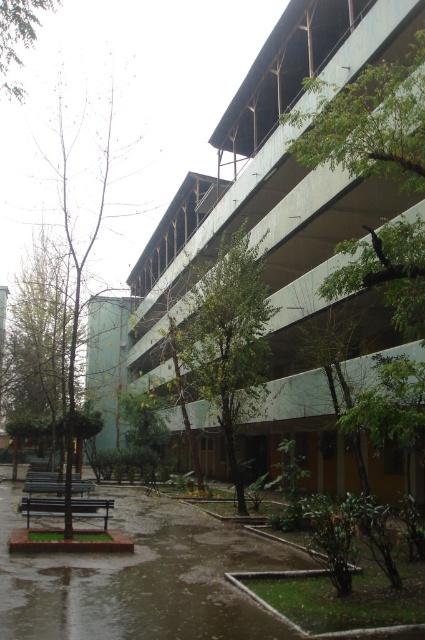
Does green leafy tree at left appear under wooden park bench at lower left?

Incorrect, green leafy tree at left is not positioned below wooden park bench at lower left.

Does green leafy tree at left have a larger size compared to wooden park bench at lower left?

Indeed, green leafy tree at left has a larger size compared to wooden park bench at lower left.

Is point (48, 310) positioned after point (59, 492)?

Yes, point (48, 310) is farther from viewer.

The width and height of the screenshot is (425, 640). I want to click on green leafy tree at left, so click(x=37, y=348).

Which is behind, point (116, 145) or point (6, 20)?

Point (116, 145)

Does bare wood tree at left have a smaller size compared to green leafy tree at upper left?

Yes.

You are a GUI agent. You are given a task and a screenshot of the screen. Output one action in this format:
    pyautogui.click(x=<x>, y=<y>)
    Task: Click on the bare wood tree at left
    This screenshot has width=425, height=640.
    Given the screenshot: What is the action you would take?
    pyautogui.click(x=82, y=202)

Can you confirm if green leafy tree at center is bigger than green leafy tree at left?

No, green leafy tree at center is not bigger than green leafy tree at left.

Does green leafy tree at center have a lesser height compared to green leafy tree at left?

Yes.

Does point (255, 333) come farther from viewer compared to point (40, 243)?

No, it is in front of (40, 243).

Find the location of a particular element. This screenshot has width=425, height=640. green leafy tree at center is located at coordinates (227, 340).